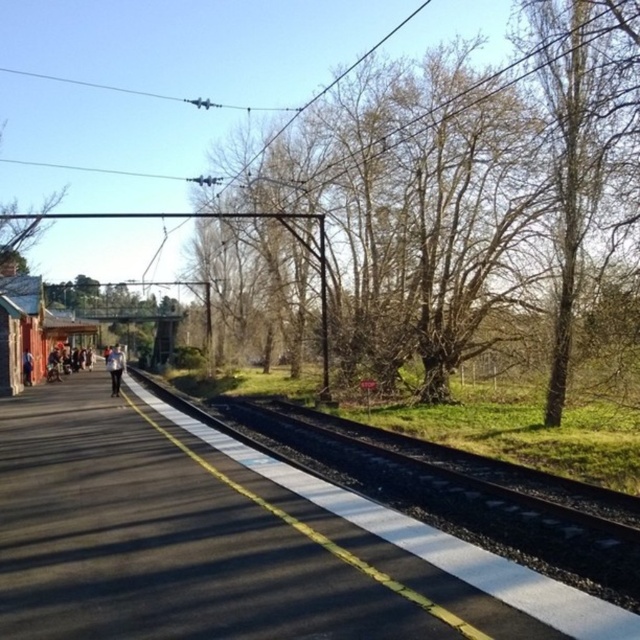
Looking at this image, you are a photographer standing on the platform at the railway station. You want to take a photo that includes both the bare branches at center and the light blue denim pants at left. Based on their positions, which object should you adjust your camera angle to focus on first to ensure both are in the frame?

Since the bare branches at center is positioned on the right side of light blue denim pants at left, you should first focus on the light blue denim pants at left to ensure both objects are included in the frame.

From the picture: You are a photographer trying to capture a wide shot of the bare branches at center and the light blue denim pants at left. If you want to include both subjects in the frame without moving your position, which subject might require you to zoom out more to fit into the shot?

The bare branches at center might be wider than the light blue denim pants at left, so you would need to zoom out more to include the bare branches at center in the frame.